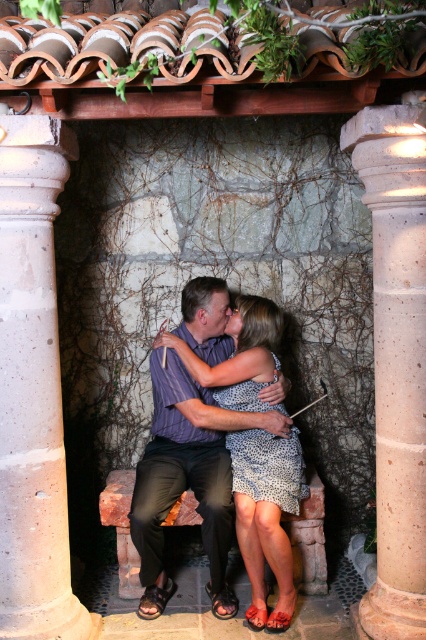
Question: Which object is closer to the camera taking this photo?

Choices:
 (A) white concrete column at left
 (B) matte purple shirt at center

Answer: (A)

Question: Can you confirm if white concrete column at left is smaller than matte purple shirt at center?

Choices:
 (A) no
 (B) yes

Answer: (B)

Question: Observing the image, what is the correct spatial positioning of speckled stone column at right in reference to matte purple shirt at center?

Choices:
 (A) left
 (B) right

Answer: (B)

Question: Is white concrete column at left above speckled stone column at right?

Choices:
 (A) no
 (B) yes

Answer: (A)

Question: Which point is farther to the camera?

Choices:
 (A) white concrete column at left
 (B) matte purple shirt at center

Answer: (B)

Question: Among these points, which one is farthest from the camera?

Choices:
 (A) (379, 545)
 (B) (224, 342)

Answer: (B)